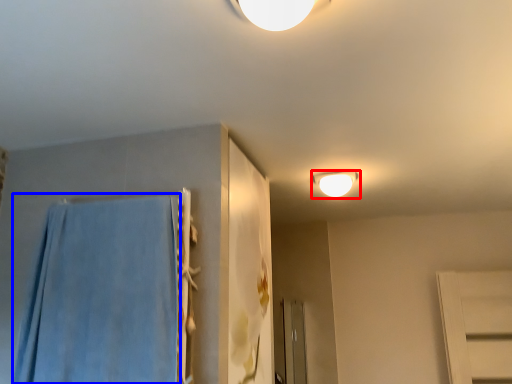
Question: Which of the following is the closest to the observer, lamp (highlighted by a red box) or bath towel (highlighted by a blue box)?

Choices:
 (A) lamp
 (B) bath towel

Answer: (B)